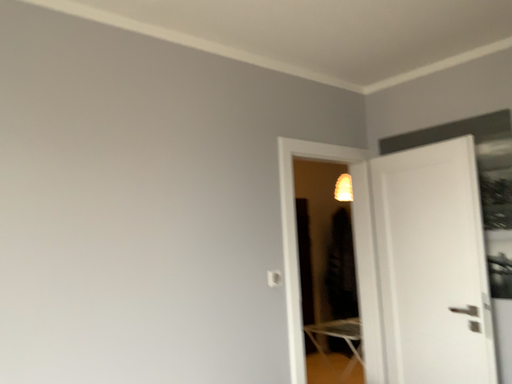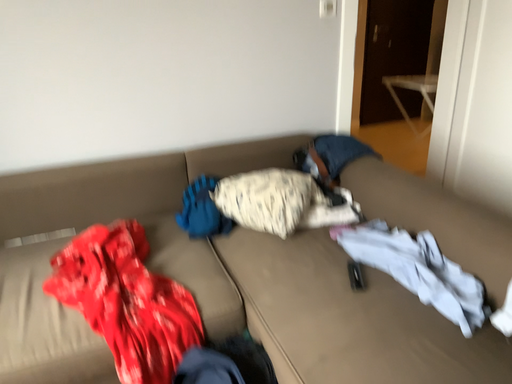
Question: Which way did the camera rotate in the video?

Choices:
 (A) rotated downward
 (B) rotated upward

Answer: (A)